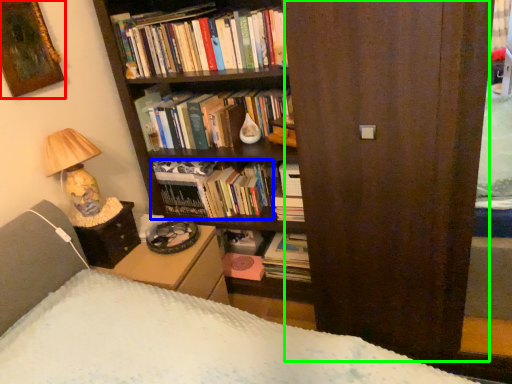
Question: Which object is positioned farthest from picture frame (highlighted by a red box)? Select from book (highlighted by a blue box) and screen door (highlighted by a green box).

Choices:
 (A) book
 (B) screen door

Answer: (B)